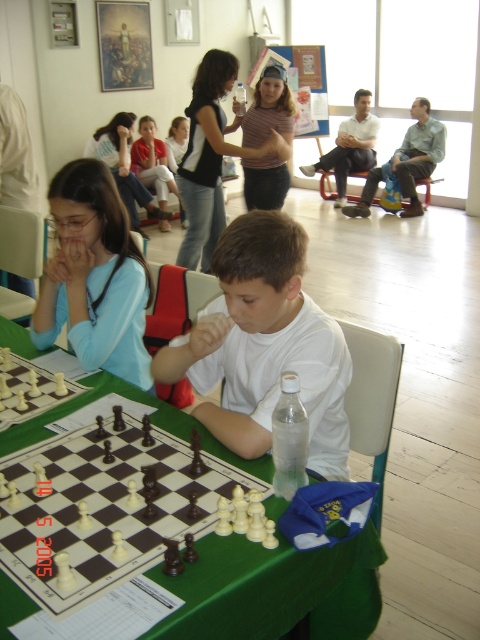
Is light brown leather shoes at center bigger than light blue fabric shirt at upper left?

No.

Consider the image. Does light brown leather shoes at center have a greater height compared to light blue fabric shirt at upper left?

No.

Identify the location of light brown leather shoes at center. (408, 161).

You are a GUI agent. You are given a task and a screenshot of the screen. Output one action in this format:
    pyautogui.click(x=<x>, y=<y>)
    Task: Click on the light brown leather shoes at center
    The width and height of the screenshot is (480, 640).
    Given the screenshot: What is the action you would take?
    coord(408,161)

Which is more to the right, white plastic chess set at center or matte blue shirt at left?

white plastic chess set at center

Is point (204, 477) more distant than point (56, 259)?

No, (204, 477) is in front of (56, 259).

This screenshot has width=480, height=640. In order to click on white plastic chess set at center in this screenshot , I will do `click(103, 509)`.

Who is positioned more to the right, green fabric table at center or matte blue shirt at left?

green fabric table at center

Who is more forward, (199, 611) or (121, 369)?

Point (199, 611) is more forward.

Identify the location of green fabric table at center. This screenshot has width=480, height=640. (275, 589).